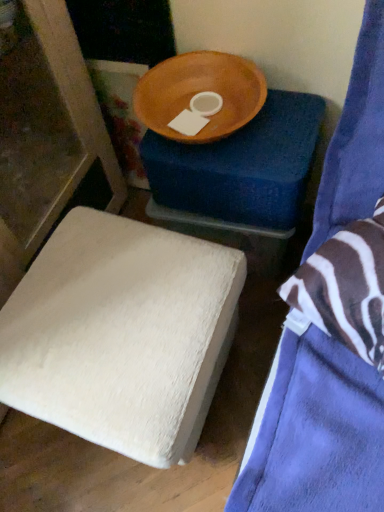
Question: From the image's perspective, is wooden bowl at upper center positioned above or below wooden bowl at upper center, which ranks as the first furniture in back-to-front order?

Choices:
 (A) above
 (B) below

Answer: (A)

Question: Is wooden bowl at upper center to the left or to the right of wooden bowl at upper center, which ranks as the first furniture in back-to-front order, in the image?

Choices:
 (A) right
 (B) left

Answer: (B)

Question: Based on their relative distances, which object is farther from the white fuzzy ottoman at lower left, which is the second furniture from back to front?

Choices:
 (A) blue fabric bed at upper right, acting as the 1th furniture starting from the front
 (B) wooden bowl at upper center, arranged as the third furniture when viewed from the front
 (C) wooden bowl at upper center

Answer: (C)

Question: Considering the real-world distances, which object is farthest from the wooden bowl at upper center?

Choices:
 (A) white fuzzy ottoman at lower left, which is counted as the second furniture, starting from the front
 (B) wooden bowl at upper center, which ranks as the first furniture in back-to-front order
 (C) blue fabric bed at upper right, acting as the 1th furniture starting from the front

Answer: (A)